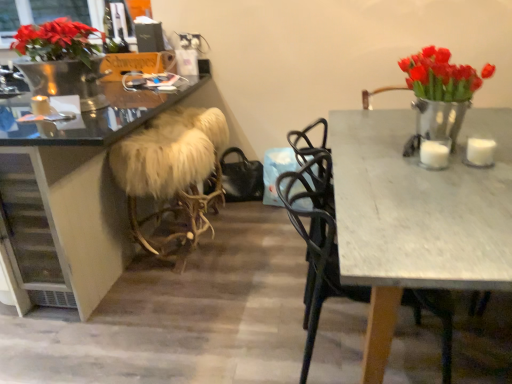
At what (x,y) coordinates should I click in order to perform the action: click on vacant area that lies between white matte candle at right, the third candle from the back, and white matte candle at right, which is counted as the 1th candle, starting from the right. Please return your answer as a coordinate pair (x, y). The image size is (512, 384). Looking at the image, I should click on (461, 158).